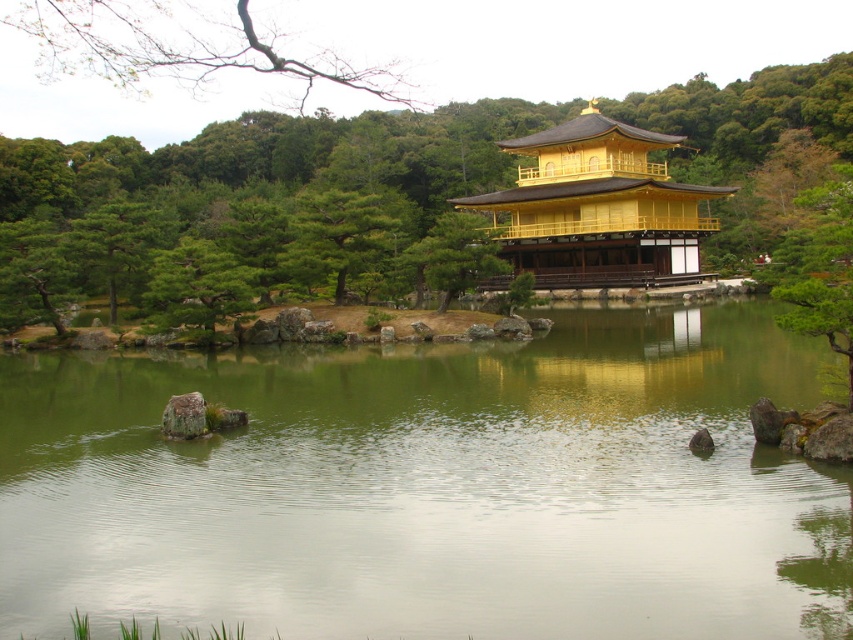
You are a visitor at Kinkakuji Temple and want to take a photo of the green matte tree at left and the green mossy rock at lower center. Which object should you zoom in on to ensure both fit in the frame?

The green mossy rock at lower center is smaller than the green matte tree at left, so you should zoom in on the green mossy rock at lower center to ensure both objects fit in the frame.

You are a visitor at Kinkakuji Temple and want to take a photo that includes both the green leafy tree at center and the green matte tree at left. Which tree should you position closer to the camera to ensure both are fully visible in the frame?

To ensure both the green leafy tree at center and the green matte tree at left are fully visible in the frame, position the green leafy tree at center closer to the camera since it is bigger than the green matte tree at left. This way, the larger tree can be framed appropriately without cropping either tree.